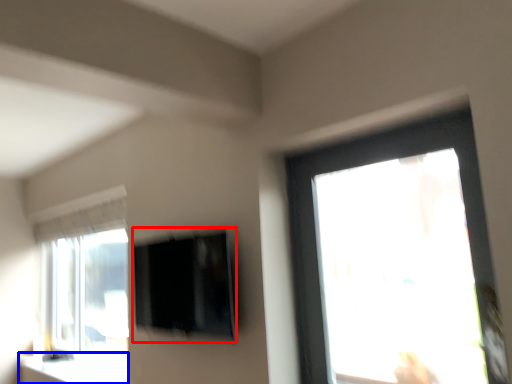
Question: Which point is further to the camera, window screen (highlighted by a red box) or window sill (highlighted by a blue box)?

Choices:
 (A) window screen
 (B) window sill

Answer: (B)